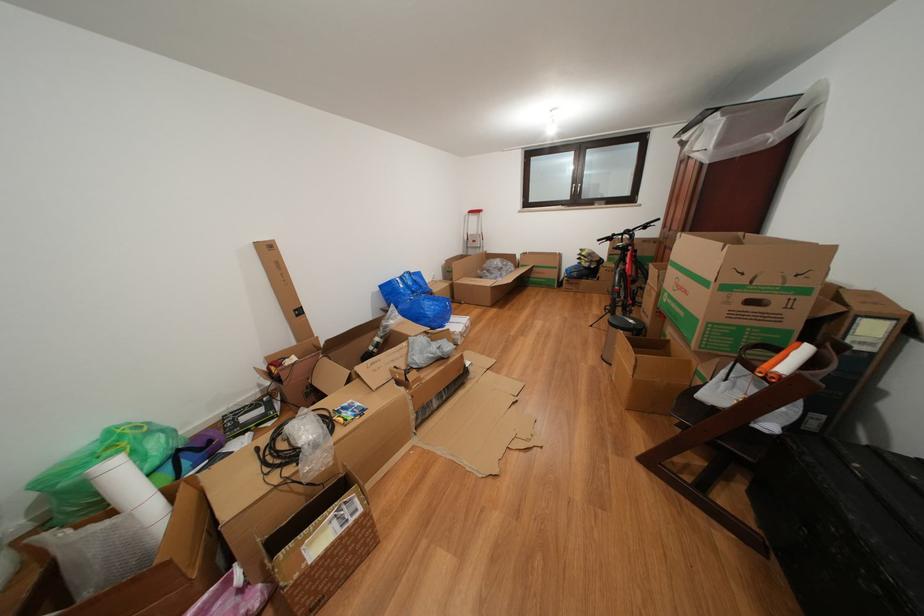
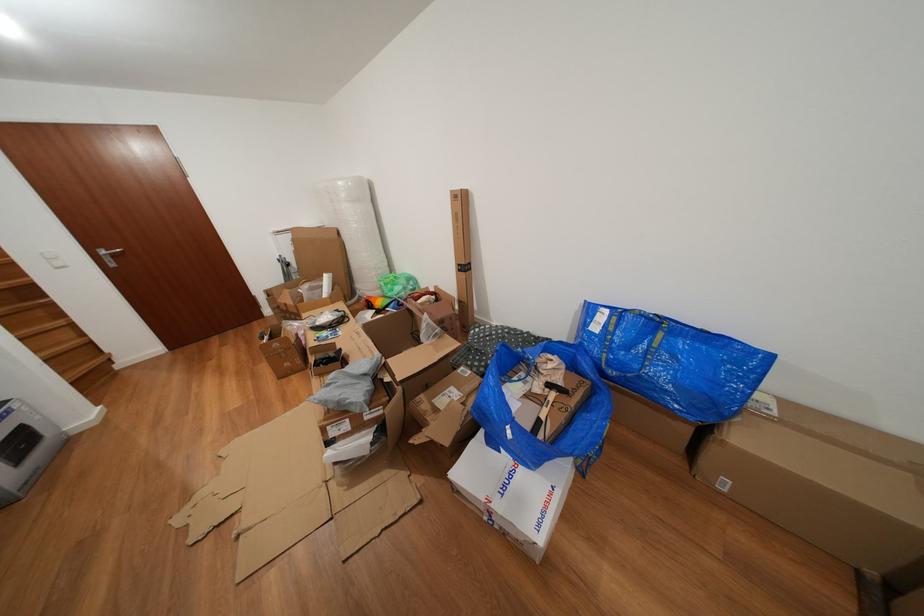
The point at (195, 469) is marked in the first image. Where is the corresponding point in the second image?

(399, 310)